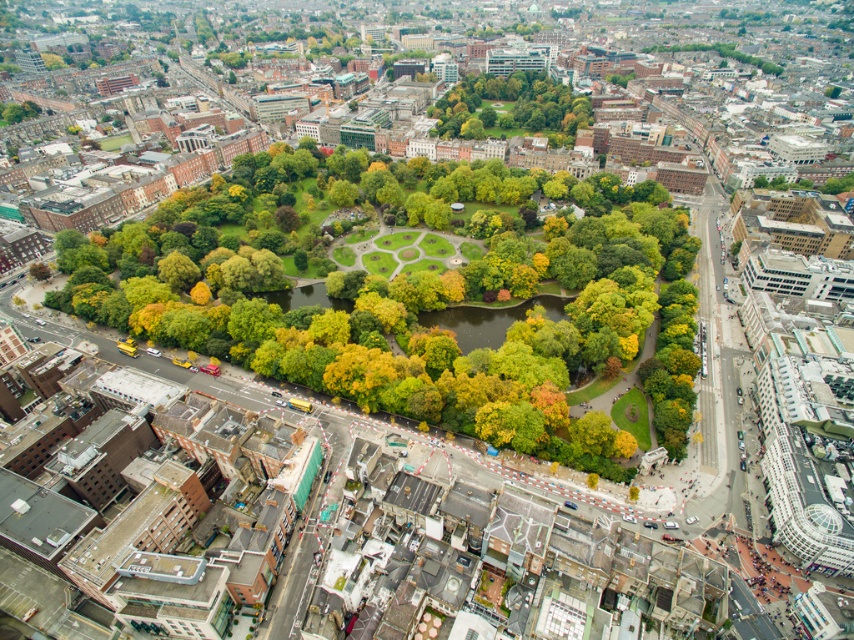
Which of these two, green leafy tree at center or green leafy tree at upper right, stands taller?

With more height is green leafy tree at center.

Does point (486, 81) come farther from viewer compared to point (654, 45)?

No, it is in front of (654, 45).

Where is `green leafy tree at center`? The image size is (854, 640). green leafy tree at center is located at coordinates (512, 106).

Can you confirm if green leafy trees at center is thinner than green leafy tree at upper right?

No.

In the scene shown: Which is above, green leafy trees at center or green leafy tree at upper right?

Positioned higher is green leafy tree at upper right.

The height and width of the screenshot is (640, 854). Describe the element at coordinates (453, 355) in the screenshot. I see `green leafy trees at center` at that location.

Where is `green leafy trees at center`? green leafy trees at center is located at coordinates (453, 355).

Which is in front, point (420, 284) or point (553, 106)?

Point (420, 284) is in front.

Who is taller, green leafy trees at center or green leafy tree at center?

green leafy tree at center

Who is more distant from viewer, (379,378) or (559,104)?

The point (559,104) is more distant.

Find the location of `green leafy trees at center`. green leafy trees at center is located at coordinates (453, 355).